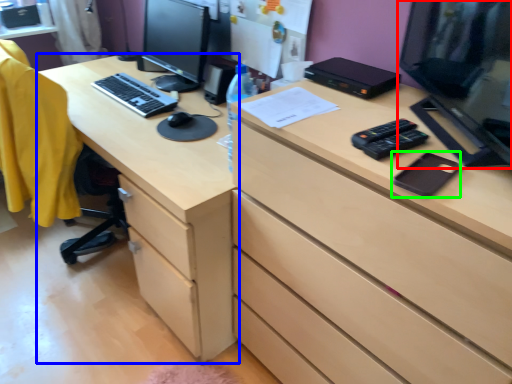
Question: Based on their relative distances, which object is nearer to computer monitor (highlighted by a red box)? Choose from desk (highlighted by a blue box) and notepad (highlighted by a green box).

Choices:
 (A) desk
 (B) notepad

Answer: (B)